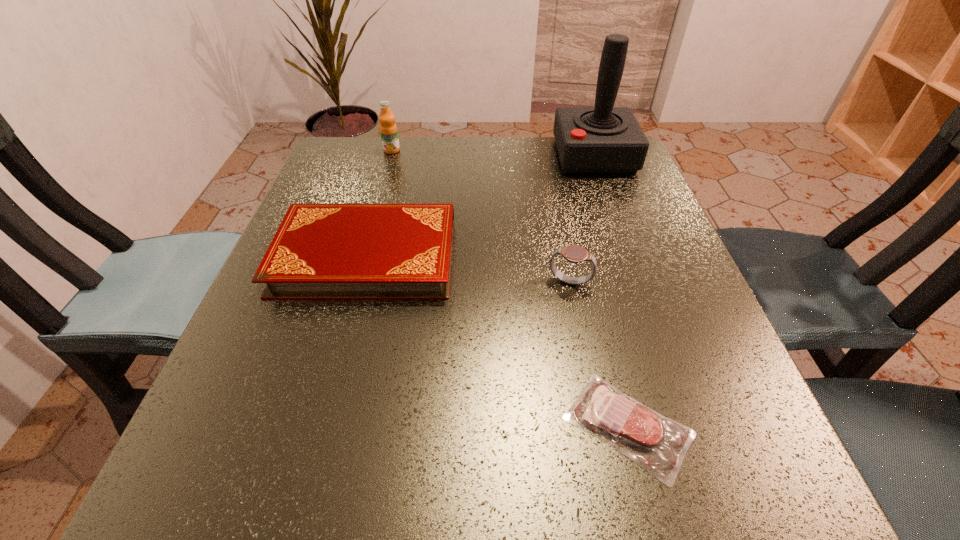
I want to click on the tallest object, so click(x=602, y=139).

Locate an element on the screen. The height and width of the screenshot is (540, 960). the fourth shortest object is located at coordinates (388, 129).

The width and height of the screenshot is (960, 540). I want to click on the third tallest object, so click(x=573, y=253).

Find the location of a particular element. The width and height of the screenshot is (960, 540). the fourth tallest object is located at coordinates (320, 251).

Where is `steak`? steak is located at coordinates (658, 444).

Find the location of a particular element. Image resolution: width=960 pixels, height=540 pixels. the shortest object is located at coordinates (658, 444).

At what (x,y) coordinates should I click in order to perform the action: click on blank space located 0.150m on the base of the tallest object. Please return your answer as a coordinate pair (x, y). This screenshot has width=960, height=540. Looking at the image, I should click on (495, 155).

Find the location of `vacant space located 0.100m on the base of the tallest object`. vacant space located 0.100m on the base of the tallest object is located at coordinates (516, 155).

Locate an element on the screen. vacant space situated 0.300m on the base of the tallest object is located at coordinates (434, 155).

You are a GUI agent. You are given a task and a screenshot of the screen. Output one action in this format:
    pyautogui.click(x=<x>, y=<y>)
    Task: Click on the blank space located 0.380m on the label of the orange juice
    The image size is (960, 540).
    Given the screenshot: What is the action you would take?
    pyautogui.click(x=361, y=260)